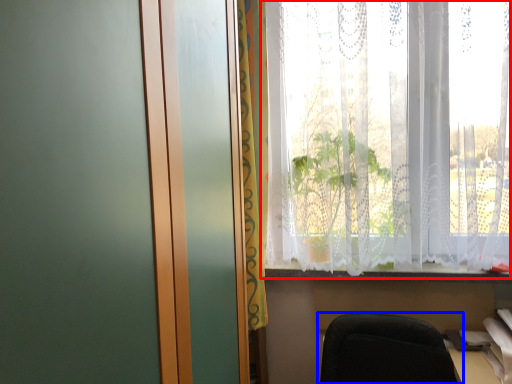
Question: Among these objects, which one is nearest to the camera, window (highlighted by a red box) or chair (highlighted by a blue box)?

Choices:
 (A) window
 (B) chair

Answer: (B)